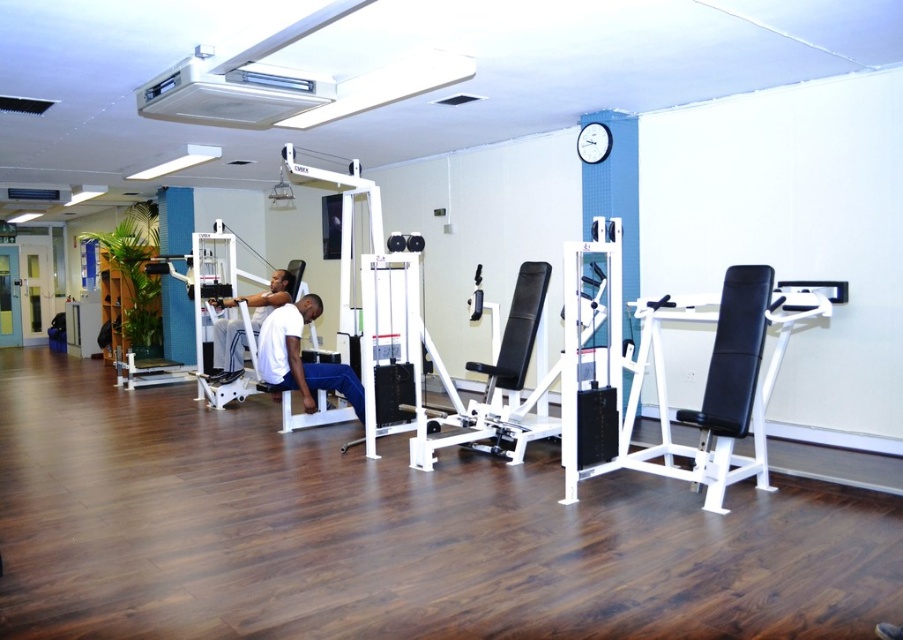
Does white matte bench at center appear over white matte weight machine at center?

No, white matte bench at center is not above white matte weight machine at center.

The height and width of the screenshot is (640, 903). What do you see at coordinates (301, 358) in the screenshot?
I see `white matte bench at center` at bounding box center [301, 358].

What do you see at coordinates (301, 358) in the screenshot? I see `white matte bench at center` at bounding box center [301, 358].

Find the location of a particular element. white matte bench at center is located at coordinates (301, 358).